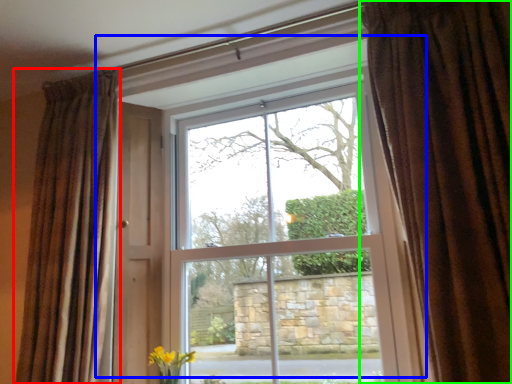
Question: Considering the real-world distances, which object is closest to curtain (highlighted by a red box)? window (highlighted by a blue box) or curtain (highlighted by a green box).

Choices:
 (A) window
 (B) curtain

Answer: (A)